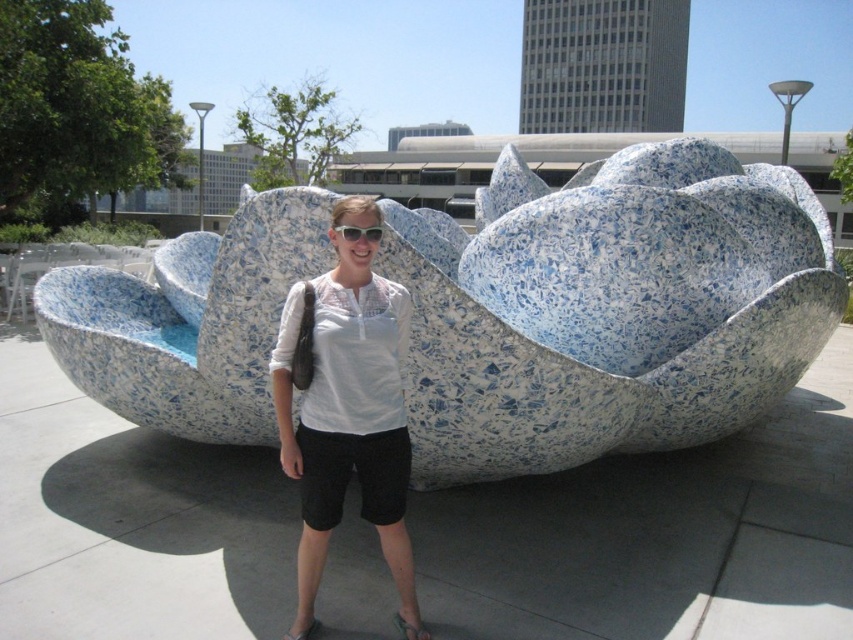
Who is lower down, blue speckled stone flower at center or white plastic sunglasses at center?

white plastic sunglasses at center is lower down.

Can you confirm if blue speckled stone flower at center is positioned below white plastic sunglasses at center?

No.

The image size is (853, 640). What do you see at coordinates (608, 308) in the screenshot?
I see `blue speckled stone flower at center` at bounding box center [608, 308].

Locate an element on the screen. Image resolution: width=853 pixels, height=640 pixels. blue speckled stone flower at center is located at coordinates (608, 308).

Where is `white lace shirt at center`? The height and width of the screenshot is (640, 853). white lace shirt at center is located at coordinates (347, 413).

Is blue speckled stone flower at center taller than white lace shirt at center?

Yes, blue speckled stone flower at center is taller than white lace shirt at center.

Which is more to the left, blue speckled stone flower at center or white lace shirt at center?

From the viewer's perspective, white lace shirt at center appears more on the left side.

The height and width of the screenshot is (640, 853). In order to click on blue speckled stone flower at center in this screenshot , I will do `click(608, 308)`.

Locate an element on the screen. blue speckled stone flower at center is located at coordinates (608, 308).